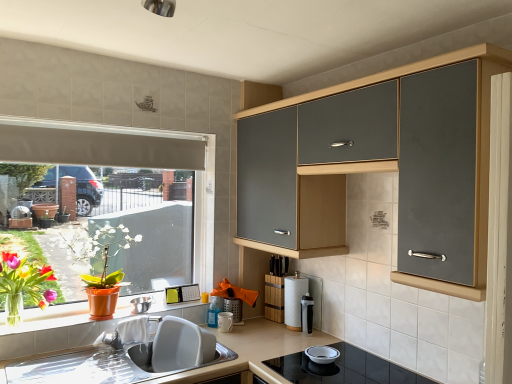
Question: Would you consider matte orange pot at left to be distant from metallic stainless steel bowl at upper left, the first appliance positioned from the left?

Choices:
 (A) yes
 (B) no

Answer: (B)

Question: Does matte orange pot at left have a greater width compared to metallic stainless steel bowl at upper left, which is the sixth appliance from right to left?

Choices:
 (A) no
 (B) yes

Answer: (B)

Question: Does matte orange pot at left come in front of metallic stainless steel bowl at upper left, the first appliance positioned from the left?

Choices:
 (A) yes
 (B) no

Answer: (A)

Question: Is matte orange pot at left to the right of metallic stainless steel bowl at upper left, the first appliance positioned from the left, from the viewer's perspective?

Choices:
 (A) yes
 (B) no

Answer: (B)

Question: From the image's perspective, does matte orange pot at left appear higher than metallic stainless steel bowl at upper left, the first appliance positioned from the left?

Choices:
 (A) yes
 (B) no

Answer: (A)

Question: Based on their positions, is white matte exhaust hood at upper left located to the left or right of orange plastic at lower left?

Choices:
 (A) right
 (B) left

Answer: (B)

Question: Does point (91, 132) appear closer or farther from the camera than point (24, 332)?

Choices:
 (A) closer
 (B) farther

Answer: (B)

Question: In terms of height, does white matte exhaust hood at upper left look taller or shorter compared to orange plastic at lower left?

Choices:
 (A) tall
 (B) short

Answer: (A)

Question: From the image's perspective, is white matte exhaust hood at upper left above or below orange plastic at lower left?

Choices:
 (A) below
 (B) above

Answer: (B)

Question: Is metallic stainless steel bowl at upper left, which is the sixth appliance from right to left, taller or shorter than beige matte countertop at lower center?

Choices:
 (A) tall
 (B) short

Answer: (B)

Question: From a real-world perspective, is metallic stainless steel bowl at upper left, the first appliance positioned from the left, above or below beige matte countertop at lower center?

Choices:
 (A) above
 (B) below

Answer: (A)

Question: Considering the positions of point (146, 302) and point (118, 380), is point (146, 302) closer or farther from the camera than point (118, 380)?

Choices:
 (A) farther
 (B) closer

Answer: (A)

Question: Considering the positions of metallic stainless steel bowl at upper left, the first appliance positioned from the left, and beige matte countertop at lower center in the image, is metallic stainless steel bowl at upper left, the first appliance positioned from the left, bigger or smaller than beige matte countertop at lower center?

Choices:
 (A) big
 (B) small

Answer: (B)

Question: Looking at their shapes, would you say metallic mesh container at center, which appears as the third appliance when viewed from the right, is wider or thinner than white matte exhaust hood at upper left?

Choices:
 (A) thin
 (B) wide

Answer: (B)

Question: Is metallic mesh container at center, which appears as the third appliance when viewed from the right, inside the boundaries of white matte exhaust hood at upper left, or outside?

Choices:
 (A) outside
 (B) inside

Answer: (A)